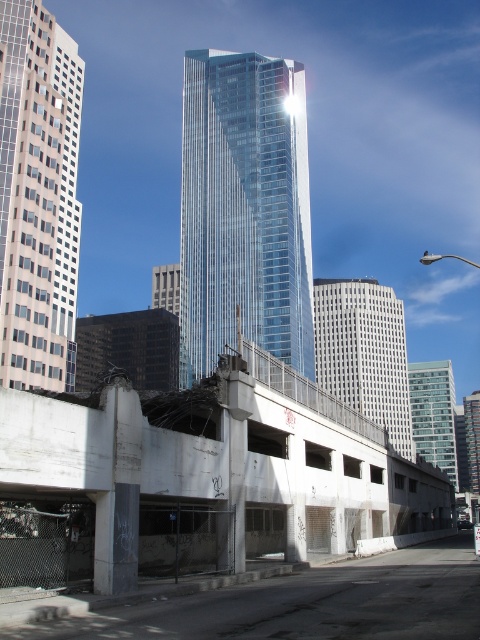
You are an urban planner evaluating the cityscape. You need to determine which structure occupies more space in the scene. Based on the image, which one is larger between the concrete parking garage at center and the glassy reflective skyscraper at center?

The glassy reflective skyscraper at center is larger than the concrete parking garage at center according to the description provided.

You are an architect analyzing the urban layout of the city. You observe the transparent glass skyscraper at center and the white glass skyscraper at center. Which one appears closer to you in the scene?

The transparent glass skyscraper at center appears closer because the white glass skyscraper at center is positioned behind it.